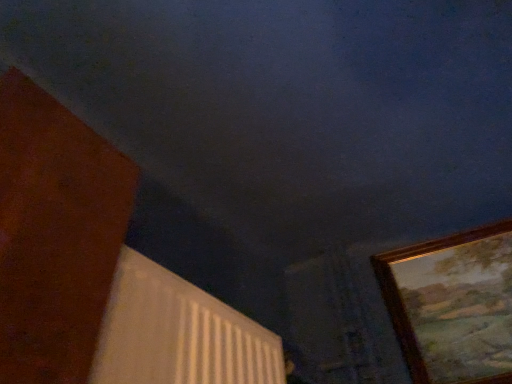
Question: Considering the relative sizes of white textured radiator at lower center and gold-framed painting at right in the image provided, is white textured radiator at lower center wider than gold-framed painting at right?

Choices:
 (A) no
 (B) yes

Answer: (B)

Question: Are white textured radiator at lower center and gold-framed painting at right located far from each other?

Choices:
 (A) no
 (B) yes

Answer: (A)

Question: Is the depth of white textured radiator at lower center greater than that of gold-framed painting at right?

Choices:
 (A) yes
 (B) no

Answer: (B)

Question: Does white textured radiator at lower center come in front of gold-framed painting at right?

Choices:
 (A) yes
 (B) no

Answer: (A)

Question: Can you confirm if white textured radiator at lower center is positioned to the right of gold-framed painting at right?

Choices:
 (A) no
 (B) yes

Answer: (A)

Question: Is white textured radiator at lower center looking in the opposite direction of gold-framed painting at right?

Choices:
 (A) no
 (B) yes

Answer: (A)

Question: Is gold-framed painting at right at the left side of white textured radiator at lower center?

Choices:
 (A) yes
 (B) no

Answer: (B)

Question: From the image's perspective, is gold-framed painting at right beneath white textured radiator at lower center?

Choices:
 (A) yes
 (B) no

Answer: (B)

Question: Is gold-framed painting at right oriented towards white textured radiator at lower center?

Choices:
 (A) yes
 (B) no

Answer: (B)

Question: From a real-world perspective, is gold-framed painting at right positioned under white textured radiator at lower center based on gravity?

Choices:
 (A) yes
 (B) no

Answer: (B)

Question: Is gold-framed painting at right wider than white textured radiator at lower center?

Choices:
 (A) no
 (B) yes

Answer: (A)

Question: Can you confirm if gold-framed painting at right is shorter than white textured radiator at lower center?

Choices:
 (A) yes
 (B) no

Answer: (B)

Question: Considering their positions, is gold-framed painting at right located in front of or behind white textured radiator at lower center?

Choices:
 (A) front
 (B) behind

Answer: (B)